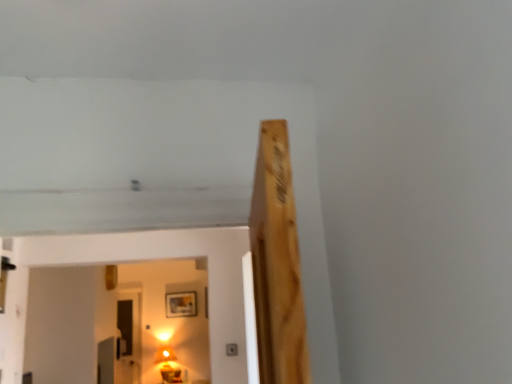
Measure the distance between matte gold lamp at lower center and camera.

matte gold lamp at lower center is 6.22 meters away from camera.

In the scene shown: In order to face transparent glass door at lower left, should I rotate leftwards or rightwards?

You should look left and rotate roughly 16.747 degrees.

Find the location of a particular element. matte gold lamp at lower center is located at coordinates (168, 365).

From the image's perspective, between transparent glass door at lower left and wooden picture frame at upper center, who is located below?

From the image's view, transparent glass door at lower left is below.

This screenshot has height=384, width=512. In order to click on glass door that appears below the wooden picture frame at upper center (from the image's perspective) in this screenshot , I will do `click(129, 339)`.

Is transparent glass door at lower left not within wooden picture frame at upper center?

Yes, transparent glass door at lower left is outside of wooden picture frame at upper center.

In the scene shown: From the image's perspective, relative to transparent glass door at lower left, is wooden picture frame at upper center above or below?

wooden picture frame at upper center is above transparent glass door at lower left.

Does wooden picture frame at upper center turn towards transparent glass door at lower left?

No, wooden picture frame at upper center is not turned towards transparent glass door at lower left.

From a real-world perspective, is wooden picture frame at upper center positioned under transparent glass door at lower left based on gravity?

No, from a real-world perspective, wooden picture frame at upper center is not below transparent glass door at lower left.

In terms of size, does wooden picture frame at upper center appear bigger or smaller than transparent glass door at lower left?

In the image, wooden picture frame at upper center appears to be smaller than transparent glass door at lower left.

Who is more distant, transparent glass door at lower left or matte gold lamp at lower center?

transparent glass door at lower left is further from the camera.

Do you think transparent glass door at lower left is within matte gold lamp at lower center, or outside of it?

The correct answer is: outside.

Which of these two, transparent glass door at lower left or matte gold lamp at lower center, is smaller?

With smaller size is transparent glass door at lower left.

From a real-world perspective, between transparent glass door at lower left and matte gold lamp at lower center, who is vertically higher?

transparent glass door at lower left.

Considering the relative sizes of wooden picture frame at upper center and matte gold lamp at lower center in the image provided, is wooden picture frame at upper center bigger than matte gold lamp at lower center?

No.

In the image, there is a matte gold lamp at lower center. Find the location of `picture frame above it (from the image's perspective)`. picture frame above it (from the image's perspective) is located at coordinates (181, 304).

From the image's perspective, which is above, wooden picture frame at upper center or matte gold lamp at lower center?

wooden picture frame at upper center, from the image's perspective.

Considering the positions of objects wooden picture frame at upper center and matte gold lamp at lower center in the image provided, who is in front, wooden picture frame at upper center or matte gold lamp at lower center?

Positioned in front is matte gold lamp at lower center.

Identify the location of lamp in front of the transparent glass door at lower left. [x=168, y=365].

Can we say matte gold lamp at lower center lies outside transparent glass door at lower left?

That's correct, matte gold lamp at lower center is outside of transparent glass door at lower left.

From a real-world perspective, is matte gold lamp at lower center above or below transparent glass door at lower left?

In terms of real-world spatial position, matte gold lamp at lower center is below transparent glass door at lower left.

Between matte gold lamp at lower center and wooden picture frame at upper center, which one has more height?

Standing taller between the two is matte gold lamp at lower center.

Is matte gold lamp at lower center bigger or smaller than wooden picture frame at upper center?

Clearly, matte gold lamp at lower center is larger in size than wooden picture frame at upper center.

Can you see matte gold lamp at lower center touching wooden picture frame at upper center?

No, matte gold lamp at lower center is not making contact with wooden picture frame at upper center.

Find the location of a particular element. lamp that is below the wooden picture frame at upper center (from the image's perspective) is located at coordinates 168,365.

You are a GUI agent. You are given a task and a screenshot of the screen. Output one action in this format:
    pyautogui.click(x=<x>, y=<y>)
    Task: Click on the glass door that is on the left side of wooden picture frame at upper center
    This screenshot has height=384, width=512.
    Given the screenshot: What is the action you would take?
    tap(129, 339)

Locate an element on the screen. The image size is (512, 384). picture frame above the transparent glass door at lower left (from the image's perspective) is located at coordinates (181, 304).

From the image, which object appears to be farther from wooden picture frame at upper center, matte gold lamp at lower center or transparent glass door at lower left?

transparent glass door at lower left is further to wooden picture frame at upper center.

Which object lies further to the anchor point matte gold lamp at lower center, transparent glass door at lower left or wooden picture frame at upper center?

The object further to matte gold lamp at lower center is wooden picture frame at upper center.

Looking at the image, which one is located closer to transparent glass door at lower left, matte gold lamp at lower center or wooden picture frame at upper center?

matte gold lamp at lower center is positioned closer to the anchor transparent glass door at lower left.

Based on their spatial positions, is wooden picture frame at upper center or transparent glass door at lower left further from matte gold lamp at lower center?

The object further to matte gold lamp at lower center is wooden picture frame at upper center.

Which object lies further to the anchor point wooden picture frame at upper center, transparent glass door at lower left or matte gold lamp at lower center?

transparent glass door at lower left is further to wooden picture frame at upper center.

Which object lies nearer to the anchor point transparent glass door at lower left, wooden picture frame at upper center or matte gold lamp at lower center?

Based on the image, matte gold lamp at lower center appears to be nearer to transparent glass door at lower left.

Locate an element on the screen. lamp located between transparent glass door at lower left and wooden picture frame at upper center in the left-right direction is located at coordinates (168, 365).